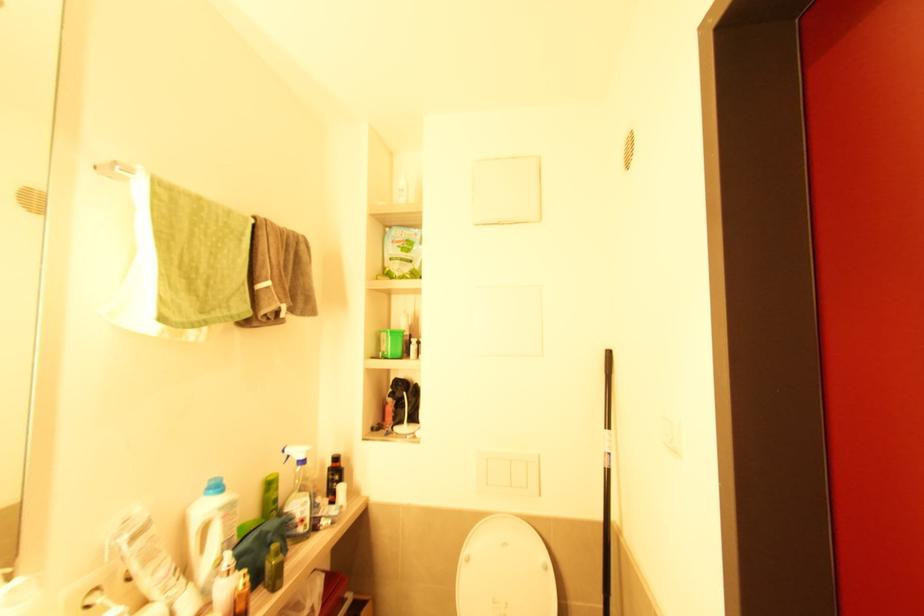
The location [210,531] corresponds to which object?

It corresponds to the white detergent bottle in the image.